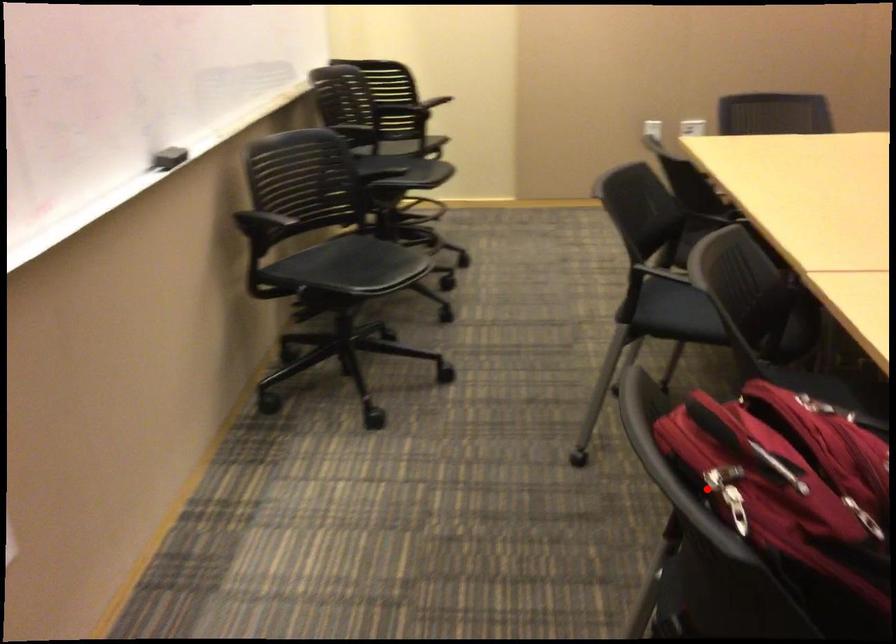
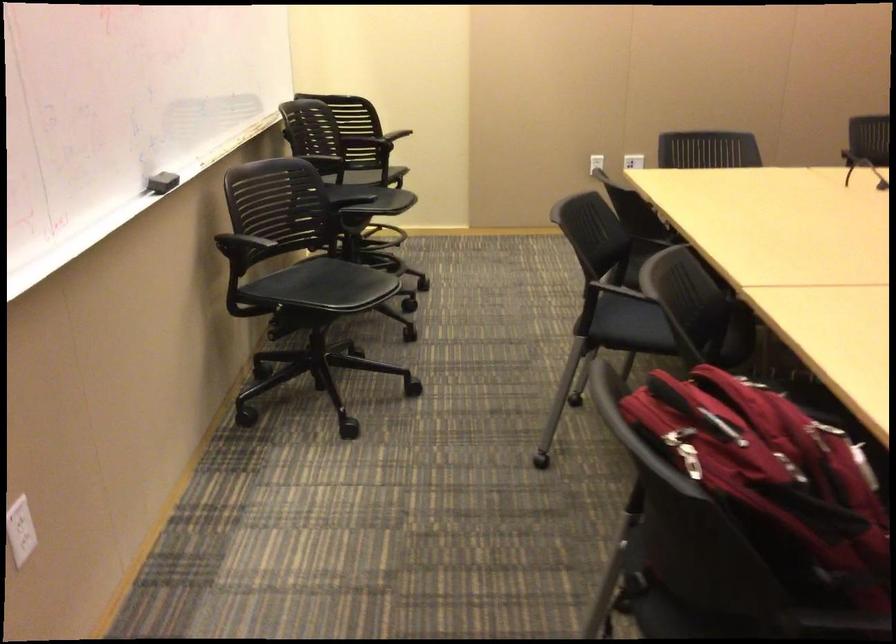
Question: A red point is marked in image1. In image2, is the corresponding 3D point closer to the camera or farther? Reply with the corresponding letter.

Choices:
 (A) The corresponding 3D point is closer.
 (B) The corresponding 3D point is farther.

Answer: (B)